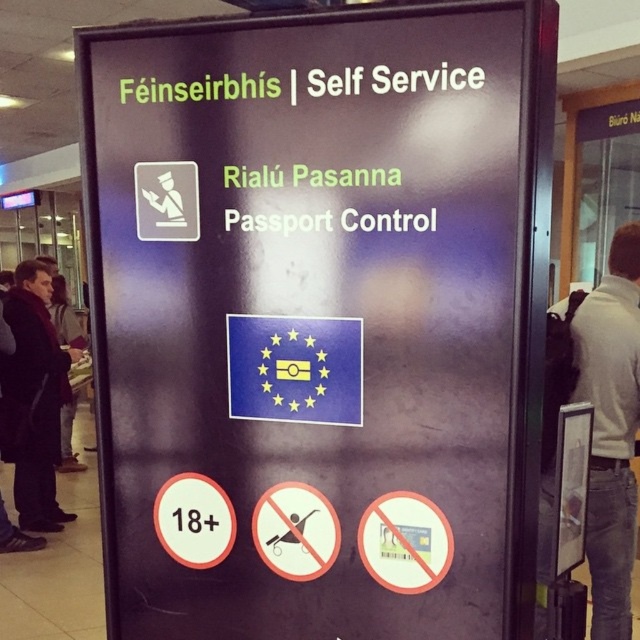
You are standing in front of the signboard at the airport. There are two points marked on the signboard. One is at point coordinates (x=358, y=436) and the other is at (x=620, y=620). Which point is closer to you?

The point at coordinates (x=358, y=436) is closer to you than the point at (x=620, y=620).